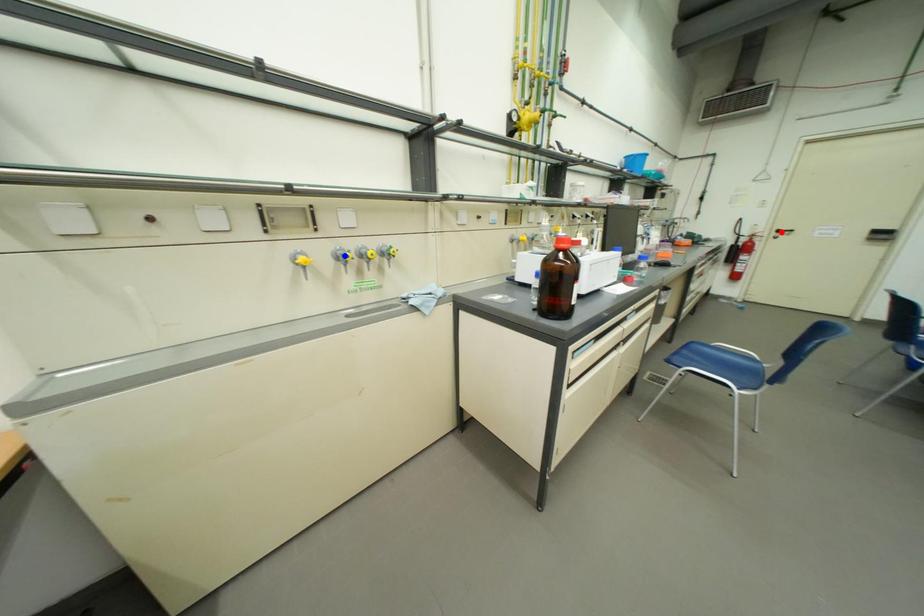
Question: Which of the two points in the image is closer to the camera?

Choices:
 (A) Blue point is closer.
 (B) Red point is closer.

Answer: (A)